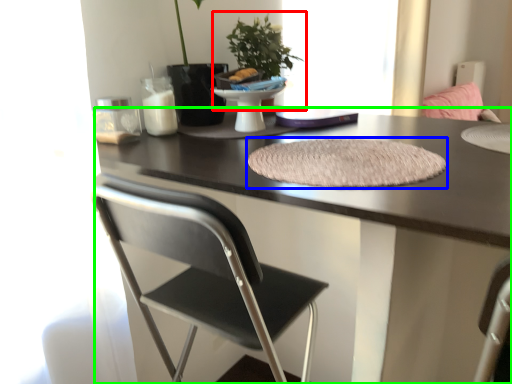
Question: Which object is the farthest from houseplant (highlighted by a red box)? Choose among these: mat (highlighted by a blue box) or desk (highlighted by a green box).

Choices:
 (A) mat
 (B) desk

Answer: (B)